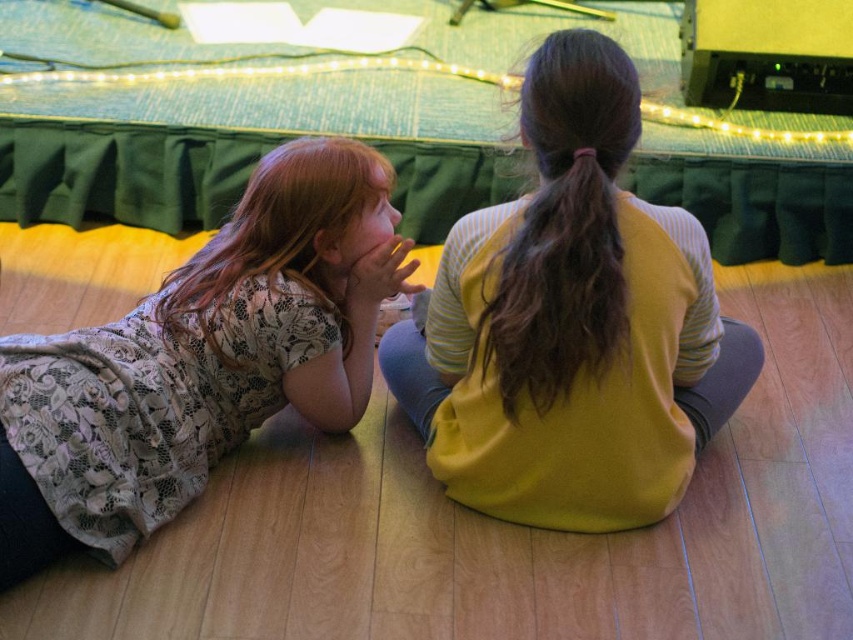
In the scene shown: Does yellow matte sweater at center appear on the left side of lace fabric dress at lower left?

Incorrect, yellow matte sweater at center is not on the left side of lace fabric dress at lower left.

Does point (531, 282) come in front of point (244, 252)?

Yes.

Is point (573, 353) farther from camera compared to point (347, 244)?

No, it is in front of (347, 244).

Find the location of a particular element. This screenshot has height=640, width=853. yellow matte sweater at center is located at coordinates (572, 323).

From the picture: Does lace fabric dress at lower left have a lesser height compared to brown silky hair at center?

No.

Which is behind, point (329, 404) or point (503, 410)?

The point (329, 404) is behind.

Locate an element on the screen. The width and height of the screenshot is (853, 640). lace fabric dress at lower left is located at coordinates (200, 358).

Can you confirm if yellow matte sweater at center is positioned above brown silky hair at center?

Incorrect, yellow matte sweater at center is not positioned above brown silky hair at center.

Is yellow matte sweater at center bigger than brown silky hair at center?

Yes, yellow matte sweater at center is bigger than brown silky hair at center.

Which is behind, point (721, 321) or point (575, 248)?

Point (721, 321)

The image size is (853, 640). In order to click on yellow matte sweater at center in this screenshot , I will do `click(572, 323)`.